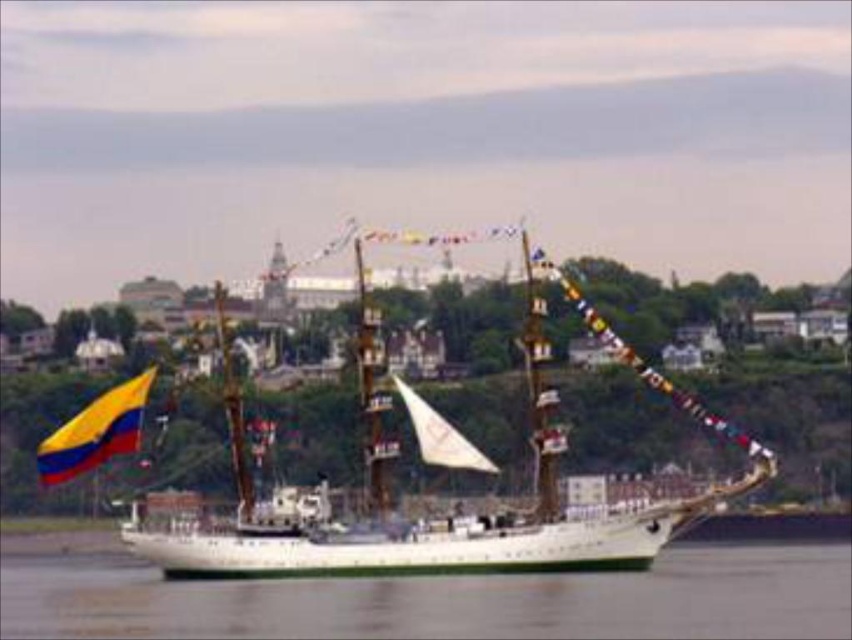
You are a photographer on a nearby boat trying to capture the white wooden ship at center and the white water at center in the same frame. Based on their heights, which object will appear larger in your photo?

The white wooden ship at center will appear larger in the photo because it has a greater height than the white water at center.